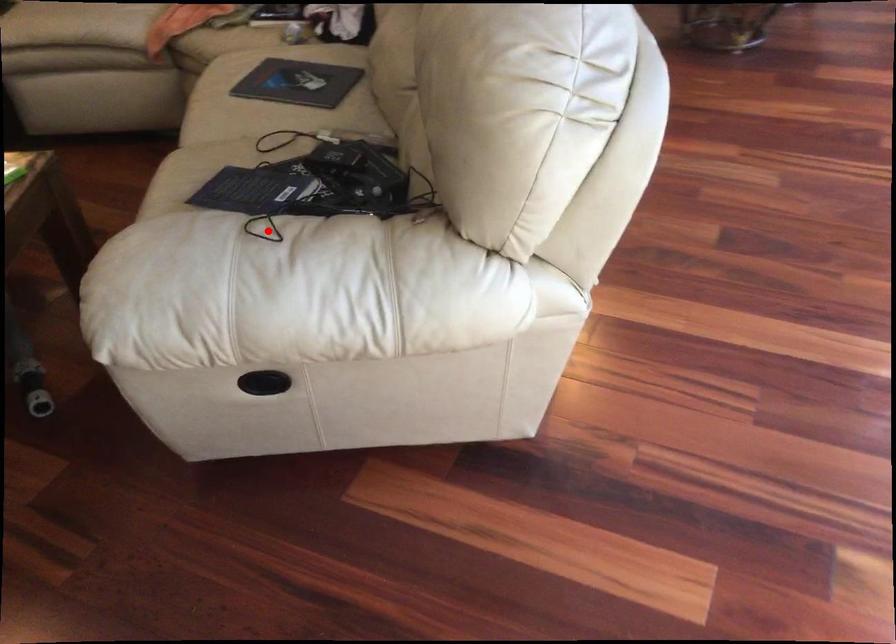
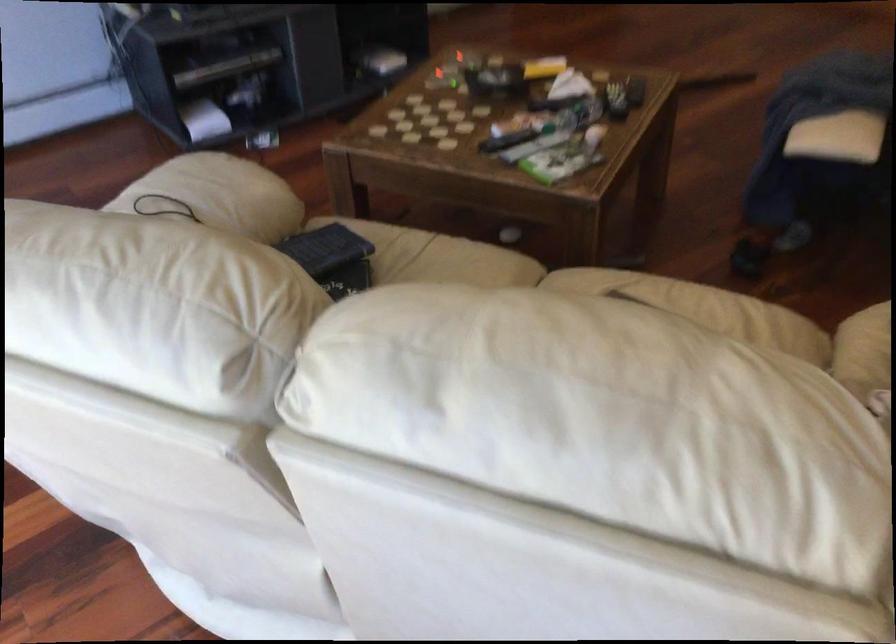
Question: I am providing you with two images of the same scene from different viewpoints. Given a red point in image1, look at the same physical point in image2. Is it:

Choices:
 (A) Closer to the viewpoint
 (B) Farther from the viewpoint

Answer: (B)